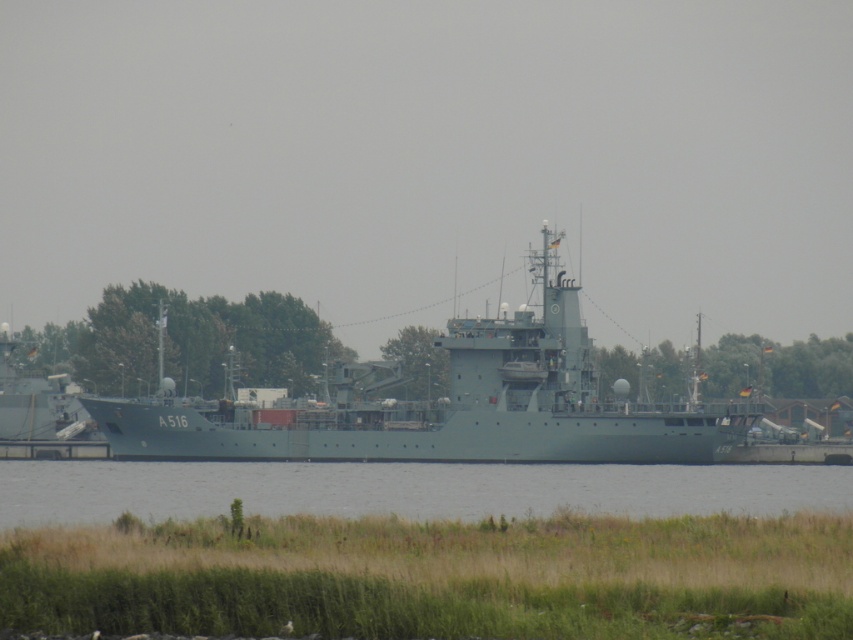
You are a harbor pilot guiding two ships. The matte gray ship at center and the green matte ship at left are both docked in the harbor. Which ship is positioned closer to the harbor entrance?

The green matte ship at left is closer to the harbor entrance because it is positioned to the left of the matte gray ship at center, which is further to the right.

From the picture: You are standing on the grassy area with wildflowers and need to reach the gray water at lower center marked by point (405, 490). Which direction should you walk to get there?

The gray water at lower center is represented by point (405, 490), so you should walk towards the lower center direction to reach it.

You are a harbor inspector observing the scene. You need to determine the relative positions of the two ships. Which ship is closer to the observer, the matte gray ship at center or the green matte ship at left?

The matte gray ship at center is closer to the observer because it is positioned in front of the green matte ship at left.